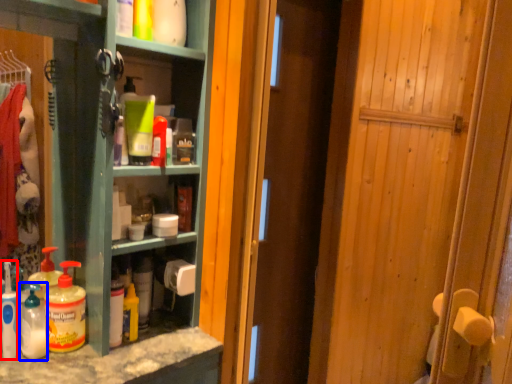
Question: Which object appears closest to the camera in this image, cleaning product (highlighted by a red box) or cleaning product (highlighted by a blue box)?

Choices:
 (A) cleaning product
 (B) cleaning product

Answer: (A)